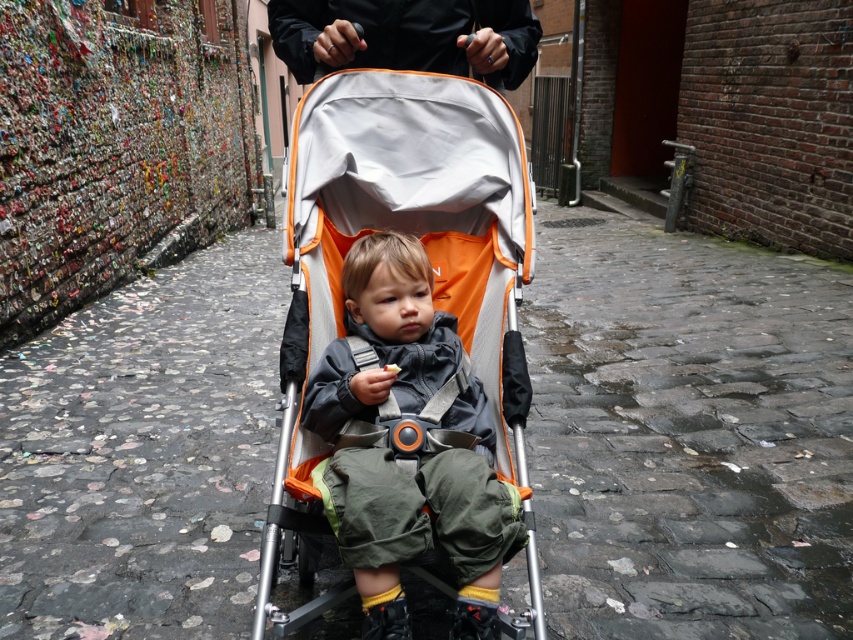
You are a parent walking through the alleyway with your child in the orange fabric baby carriage at center and wearing the black matte jacket at upper center. You notice a small opening to your left that you want to enter. Can you maneuver the stroller to the left side of the alley without hitting the left wall?

The orange fabric baby carriage at center is positioned to the right of the black matte jacket at upper center. Since the stroller is already to the right side of the jacket, there might be enough space to move it left. However, the alley is narrow, so you should check the distance between the stroller and the left wall before attempting to move.

You are a delivery person trying to navigate through the narrow alleyway. You need to pass by the orange fabric baby carriage at center and the black matte jacket at upper center. Which object requires more space to maneuver around?

The black matte jacket at upper center requires more space to maneuver around because its width is greater than the orange fabric baby carriage at center.

You are a delivery person trying to navigate through the narrow alleyway. You see the orange fabric baby carriage at center and the black matte jacket at upper center. Which object takes up more space in the image?

The orange fabric baby carriage at center is bigger than the black matte jacket at upper center, so it takes up more space in the image.